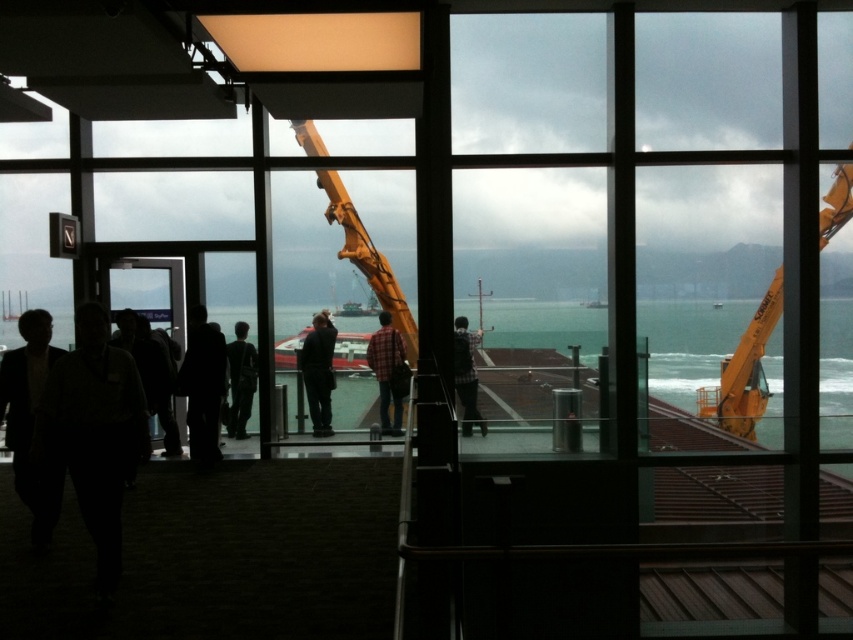
Between point (42, 508) and point (236, 333), which one is positioned in front?

Point (42, 508) is more forward.

Between dark suit at left and dark gray pants at center, which one is positioned lower?

dark suit at left

Is point (42, 515) positioned in front of point (248, 358)?

Yes, it is.

You are a GUI agent. You are given a task and a screenshot of the screen. Output one action in this format:
    pyautogui.click(x=<x>, y=<y>)
    Task: Click on the dark suit at left
    The width and height of the screenshot is (853, 640).
    Given the screenshot: What is the action you would take?
    pyautogui.click(x=30, y=420)

Does dark suit at left appear on the right side of plaid fabric shirt at center?

No, dark suit at left is not to the right of plaid fabric shirt at center.

Does point (1, 369) come farther from viewer compared to point (386, 381)?

That is False.

Who is more forward, (35, 310) or (384, 364)?

Point (35, 310) is in front.

Find the location of a particular element. dark suit at left is located at coordinates (30, 420).

Can you confirm if clear water at center is shorter than dark gray suit at center?

Yes, clear water at center is shorter than dark gray suit at center.

Which is in front, point (509, 403) or point (325, 422)?

Point (509, 403)

At what (x,y) coordinates should I click in order to perform the action: click on clear water at center. Please return your answer as a coordinate pair (x, y). The height and width of the screenshot is (640, 853). Looking at the image, I should click on (688, 342).